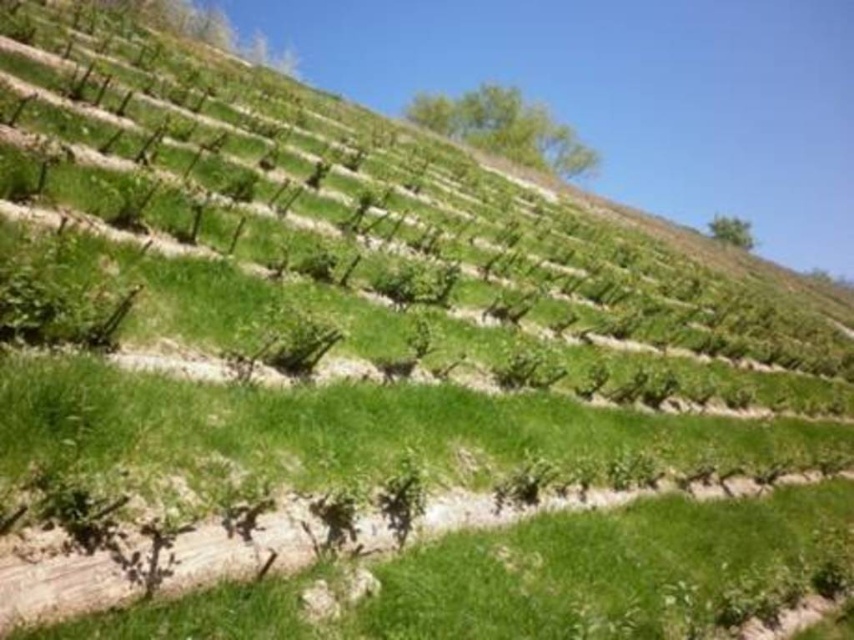
You are a drone operator tasked with capturing aerial footage of the vineyard. The two green leafy trees are important landmarks for your flight path. If your drone has a maximum battery life that allows it to travel 20 meters before needing to recharge, can the drone safely fly from the green leafy tree at upper center to the green leafy tree at upper right without needing to recharge?

A: The green leafy tree at upper center and green leafy tree at upper right are 18.17 meters apart from each other. Since 18.17 meters is less than the drone battery life limit of 20 meters, the drone can safely fly between them without needing to recharge.

From the picture: You are standing at the bottom of the vineyard looking up. There is a point marked at coordinates point (506, 129). What object is located at that point?

The point (506, 129) corresponds to a green leafy tree at upper center.

You are a farmer planning to plant a new grapevine row between the green leafy tree at upper center and the green leafy tree at upper right. Considering their sizes, which tree should you avoid placing the new row closer to?

You should avoid placing the new row closer to the green leafy tree at upper center because it has a larger size compared to the green leafy tree at upper right, which might cast more shade or require more space.